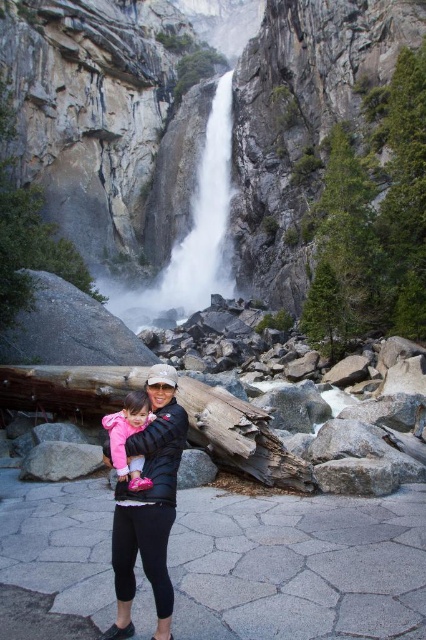
Is matte black jacket at center to the right of pink fabric dress at center from the viewer's perspective?

Yes, matte black jacket at center is to the right of pink fabric dress at center.

Who is higher up, matte black jacket at center or pink fabric dress at center?

Positioned higher is pink fabric dress at center.

Is point (118, 557) closer to camera compared to point (123, 477)?

That is True.

This screenshot has width=426, height=640. What are the coordinates of `matte black jacket at center` in the screenshot? It's located at (149, 506).

Is matte black jacket at center wider than white frothy water at center?

No, matte black jacket at center is not wider than white frothy water at center.

Where is `matte black jacket at center`? The width and height of the screenshot is (426, 640). matte black jacket at center is located at coordinates (149, 506).

Between white frothy water at center and pink fabric dress at center, which one has more height?

white frothy water at center is taller.

Does white frothy water at center appear on the left side of pink fabric dress at center?

Yes, white frothy water at center is to the left of pink fabric dress at center.

Between point (204, 262) and point (138, 465), which one is positioned in front?

Point (138, 465)

I want to click on white frothy water at center, so click(190, 236).